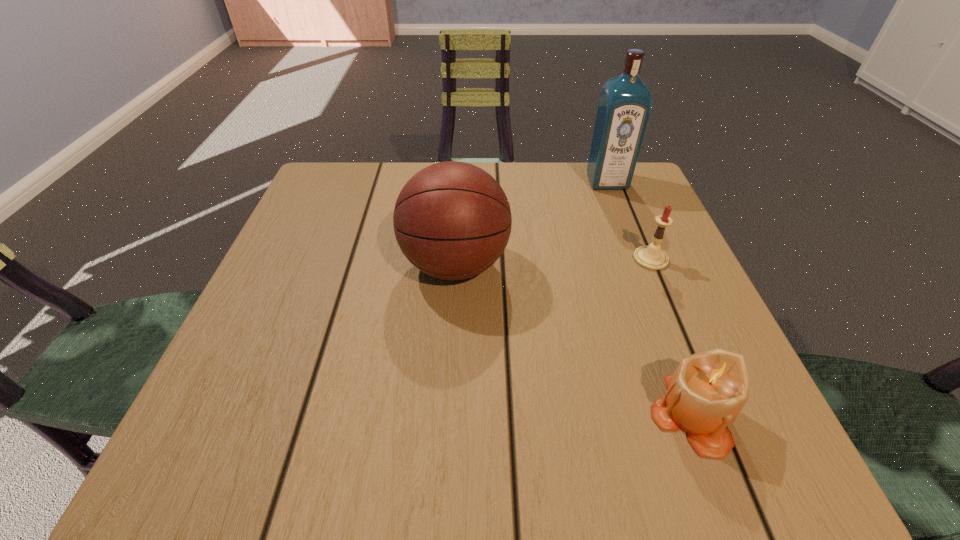
Find the location of a particular element. Image resolution: width=960 pixels, height=540 pixels. free space between the farther candle and the liquor is located at coordinates (629, 220).

Locate an element on the screen. The width and height of the screenshot is (960, 540). vacant region between the basketball and the liquor is located at coordinates (531, 223).

This screenshot has width=960, height=540. In order to click on object that is the second closest to the basketball in this screenshot , I will do `click(651, 257)`.

This screenshot has width=960, height=540. I want to click on the second closest object relative to the farther candle, so click(x=708, y=390).

The height and width of the screenshot is (540, 960). I want to click on vacant space that satisfies the following two spatial constraints: 1. on the flat label side of the farthest object; 2. on the left side of the farther candle, so click(636, 259).

The width and height of the screenshot is (960, 540). Find the location of `blank area in the image that satisfies the following two spatial constraints: 1. on the front side of the third shortest object; 2. on the left side of the nearest object`. blank area in the image that satisfies the following two spatial constraints: 1. on the front side of the third shortest object; 2. on the left side of the nearest object is located at coordinates (446, 414).

The width and height of the screenshot is (960, 540). Identify the location of vacant space that satisfies the following two spatial constraints: 1. on the back side of the farther candle; 2. on the right side of the basketball. (456, 259).